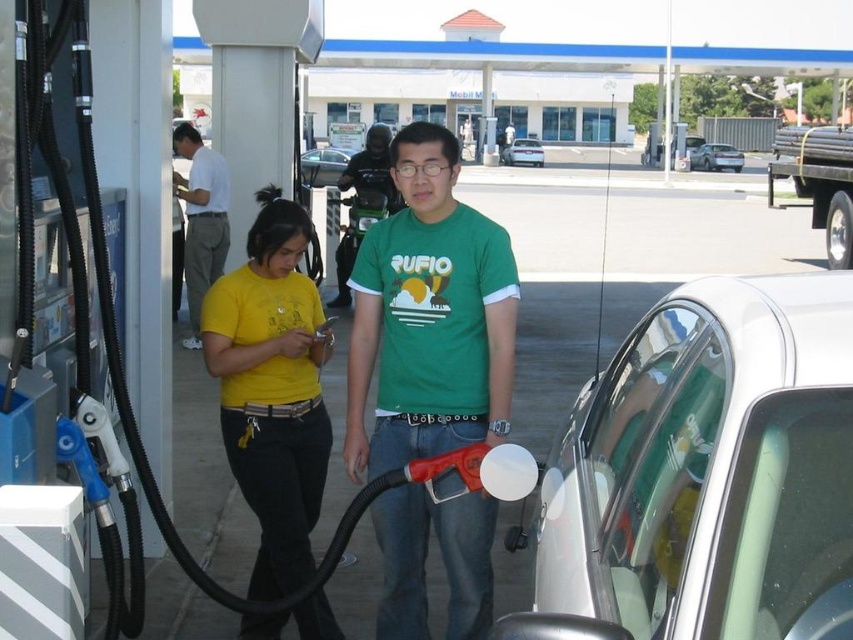
Is white glossy car at right to the left of green matte t-shirt at center from the viewer's perspective?

In fact, white glossy car at right is to the right of green matte t-shirt at center.

Can you confirm if white glossy car at right is positioned to the right of green matte t-shirt at center?

Yes, white glossy car at right is to the right of green matte t-shirt at center.

The width and height of the screenshot is (853, 640). I want to click on white glossy car at right, so click(x=705, y=474).

At what (x,y) coordinates should I click in order to perform the action: click on white glossy car at right. Please return your answer as a coordinate pair (x, y). Image resolution: width=853 pixels, height=640 pixels. Looking at the image, I should click on (705, 474).

Looking at this image, who is positioned more to the left, white glossy car at right or yellow matte shirt at center?

yellow matte shirt at center

Can you confirm if white glossy car at right is positioned to the left of yellow matte shirt at center?

No, white glossy car at right is not to the left of yellow matte shirt at center.

Is point (741, 380) behind point (252, 248)?

That is False.

The width and height of the screenshot is (853, 640). What are the coordinates of `white glossy car at right` in the screenshot? It's located at (705, 474).

Who is positioned more to the left, yellow matte shirt at center or white cotton shirt at left?

Positioned to the left is white cotton shirt at left.

What are the coordinates of `yellow matte shirt at center` in the screenshot? It's located at (271, 388).